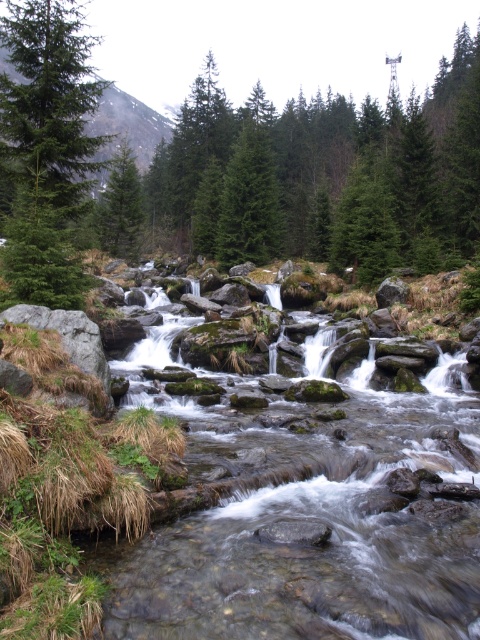
Question: Is smooth gray rocks at center to the right of green matte tree at center from the viewer's perspective?

Choices:
 (A) no
 (B) yes

Answer: (A)

Question: Estimate the real-world distances between objects in this image. Which object is farther from the green matte evergreen tree at center?

Choices:
 (A) smooth gray rocks at center
 (B) green matte tree at center
 (C) green matte tree at left

Answer: (A)

Question: Can you confirm if green matte tree at center is thinner than green matte evergreen tree at center?

Choices:
 (A) yes
 (B) no

Answer: (A)

Question: Among these objects, which one is farthest from the camera?

Choices:
 (A) smooth gray rocks at center
 (B) green matte tree at left

Answer: (B)

Question: Which point appears farthest from the camera in this image?

Choices:
 (A) (266, 516)
 (B) (60, 196)
 (C) (227, 216)

Answer: (C)

Question: Does green matte tree at center have a smaller size compared to green matte evergreen tree at center?

Choices:
 (A) no
 (B) yes

Answer: (B)